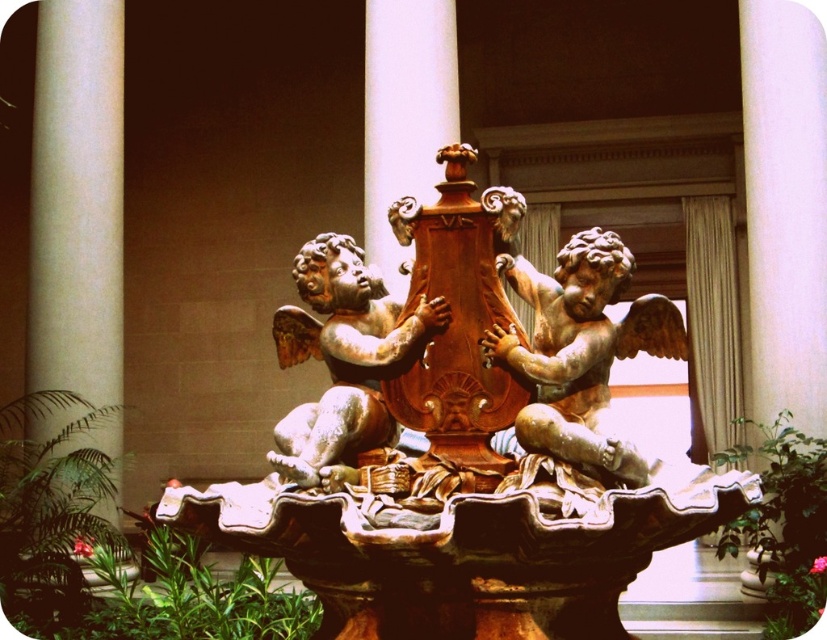
Locate an element on the screen. Image resolution: width=827 pixels, height=640 pixels. white smooth pillar at left is located at coordinates (79, 211).

Who is shorter, white smooth pillar at left or brown polished wood at center?

With less height is brown polished wood at center.

Locate an element on the screen. Image resolution: width=827 pixels, height=640 pixels. white smooth pillar at left is located at coordinates (79, 211).

Describe the element at coordinates (472, 444) in the screenshot. I see `matte bronze cherub fountain at center` at that location.

Between matte bronze cherub fountain at center and golden polished cherub at center, which one has more height?

With more height is matte bronze cherub fountain at center.

Locate an element on the screen. matte bronze cherub fountain at center is located at coordinates (472, 444).

This screenshot has height=640, width=827. In order to click on matte bronze cherub fountain at center in this screenshot , I will do `click(472, 444)`.

Is point (734, 515) positioned behind point (378, 189)?

No, it is in front of (378, 189).

Is matte bronze cherub fountain at center to the right of brown polished wood at center from the viewer's perspective?

Indeed, matte bronze cherub fountain at center is positioned on the right side of brown polished wood at center.

Does point (319, 586) come behind point (375, 182)?

No, (319, 586) is in front of (375, 182).

Image resolution: width=827 pixels, height=640 pixels. Identify the location of matte bronze cherub fountain at center. (472, 444).